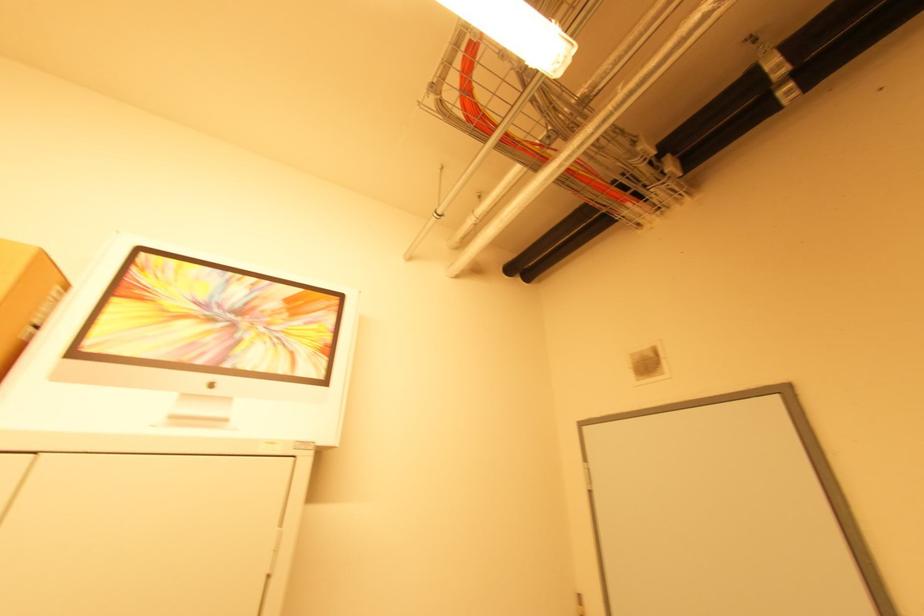
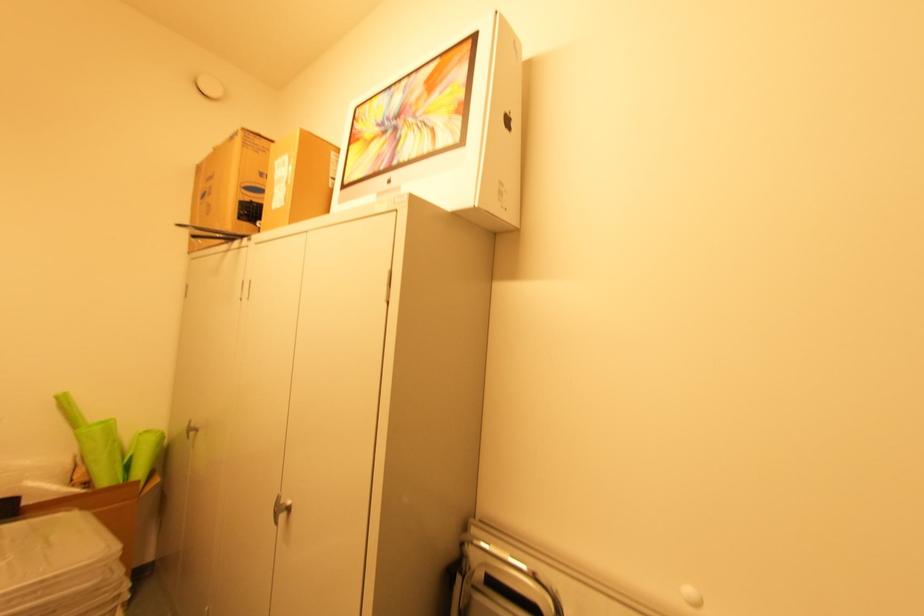
In the second image, find the point that corresponds to (117,300) in the first image.

(353, 148)